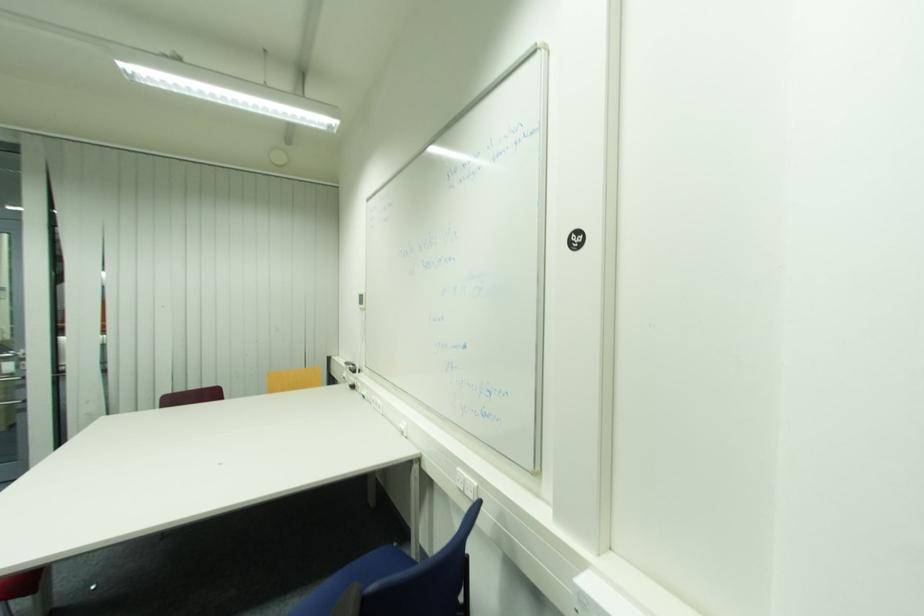
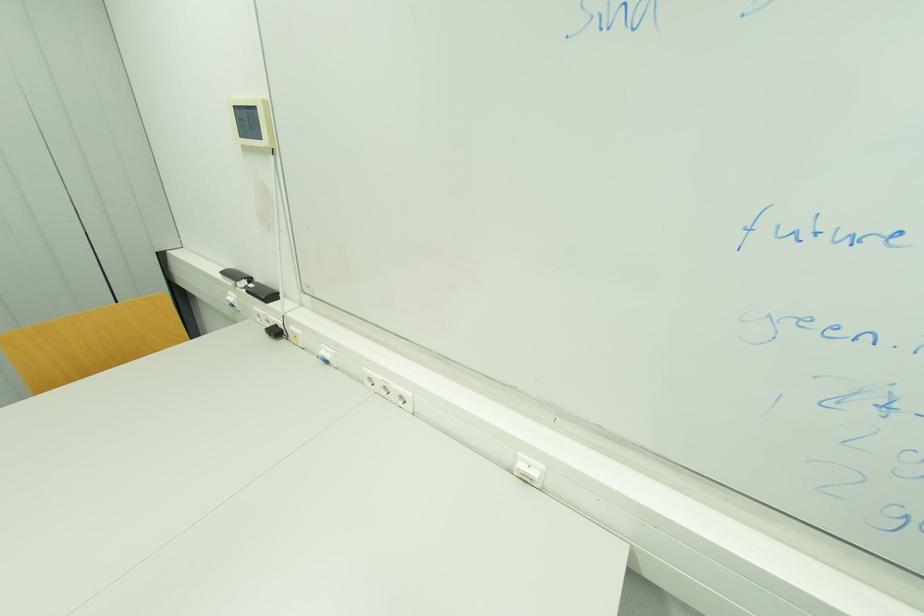
Locate, in the second image, the point that corresponds to point (357, 387) in the first image.

(281, 333)